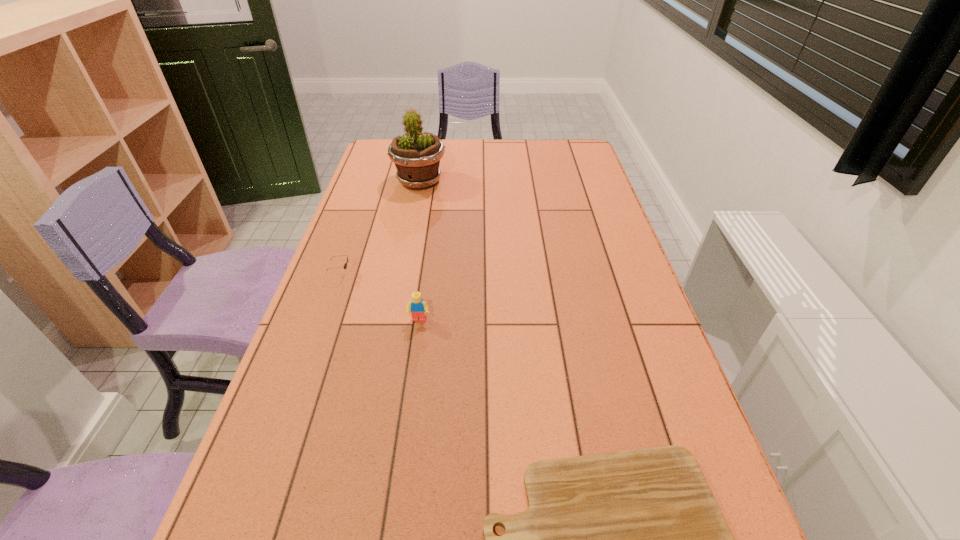
In order to click on sunglasses present at the left edge in this screenshot , I will do `click(345, 265)`.

Where is `vacant region at the far edge`? This screenshot has width=960, height=540. vacant region at the far edge is located at coordinates (535, 151).

In the image, there is a desktop. What are the coordinates of `vacant space at the left edge` in the screenshot? It's located at (308, 475).

Locate an element on the screen. vacant point at the right edge is located at coordinates (636, 272).

Locate an element on the screen. free space between the Lego and the second shortest object is located at coordinates (380, 297).

Find the location of a particular element. free space between the tallest object and the second shortest object is located at coordinates (380, 228).

Locate an element on the screen. free space between the leftmost object and the third farthest object is located at coordinates [380, 297].

At what (x,y) coordinates should I click in order to perform the action: click on free spot between the flowerpot and the Lego. Please return your answer as a coordinate pair (x, y). Looking at the image, I should click on (420, 251).

Image resolution: width=960 pixels, height=540 pixels. Identify the location of free space between the second nearest object and the leftmost object. (380, 297).

At what (x,y) coordinates should I click in order to perform the action: click on vacant region between the second tallest object and the sunglasses. Please return your answer as a coordinate pair (x, y). The image size is (960, 540). Looking at the image, I should click on (380, 297).